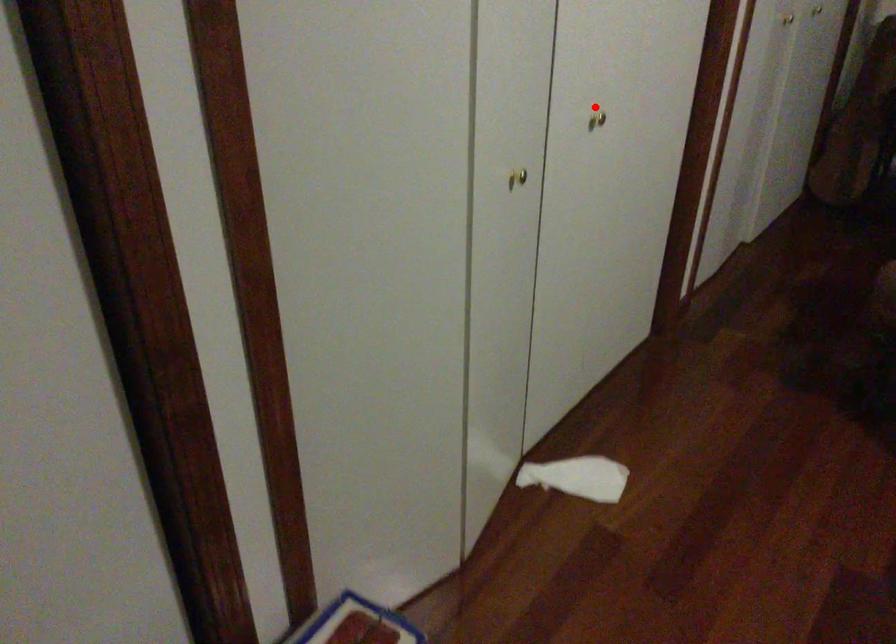
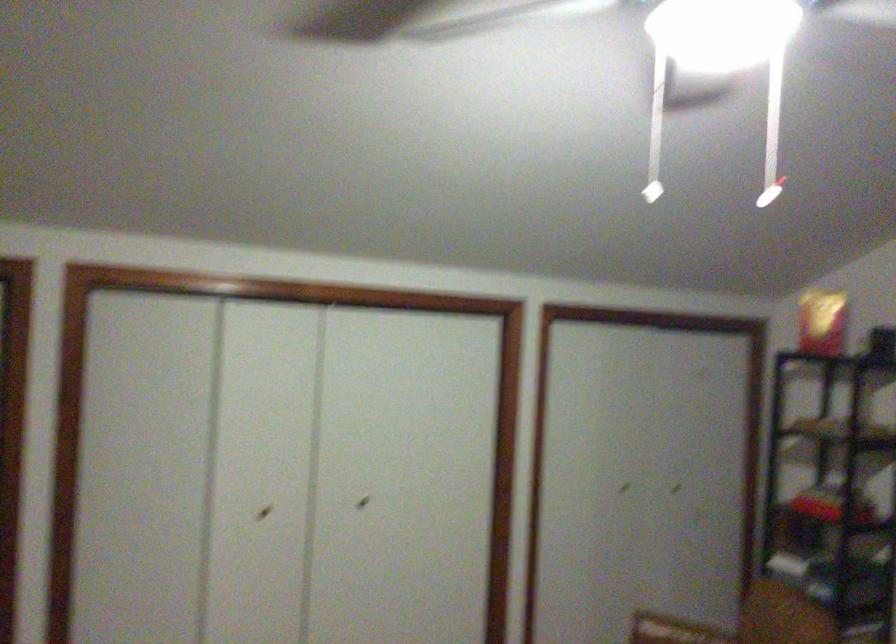
Locate, in the second image, the point that corresponds to the highlighted location in the first image.

(363, 502)